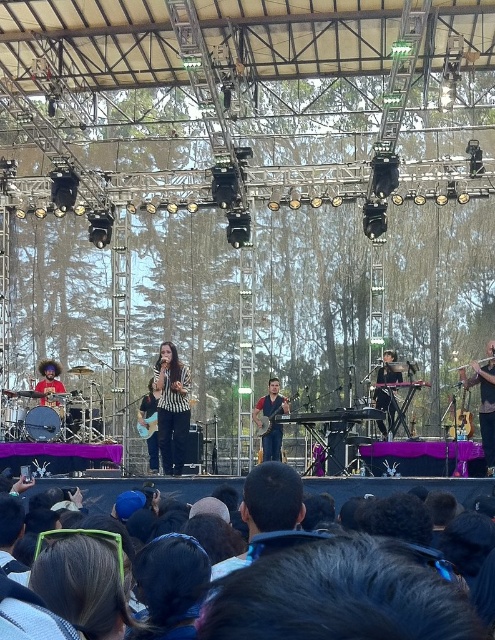
Consider the image. Is blue denim jeans at center to the left of wooden acoustic guitar at center from the viewer's perspective?

No, blue denim jeans at center is not to the left of wooden acoustic guitar at center.

Is blue denim jeans at center further to camera compared to wooden acoustic guitar at center?

Yes, blue denim jeans at center is further from the viewer.

What do you see at coordinates (270, 419) in the screenshot? The width and height of the screenshot is (495, 640). I see `blue denim jeans at center` at bounding box center [270, 419].

Where is `blue denim jeans at center`? This screenshot has height=640, width=495. blue denim jeans at center is located at coordinates (270, 419).

Does striped fabric at center appear on the left side of blue denim jeans at center?

Yes, striped fabric at center is to the left of blue denim jeans at center.

Between striped fabric at center and blue denim jeans at center, which one is positioned higher?

striped fabric at center

Is point (158, 365) closer to viewer compared to point (273, 397)?

That is True.

The width and height of the screenshot is (495, 640). I want to click on striped fabric at center, so click(171, 406).

Is the position of dark hair at lower center less distant than that of striped fabric at center?

Yes, it is.

Can you confirm if dark hair at lower center is bigger than striped fabric at center?

Correct, dark hair at lower center is larger in size than striped fabric at center.

Identify the location of dark hair at lower center. (394, 486).

The height and width of the screenshot is (640, 495). Identify the location of dark hair at lower center. (394, 486).